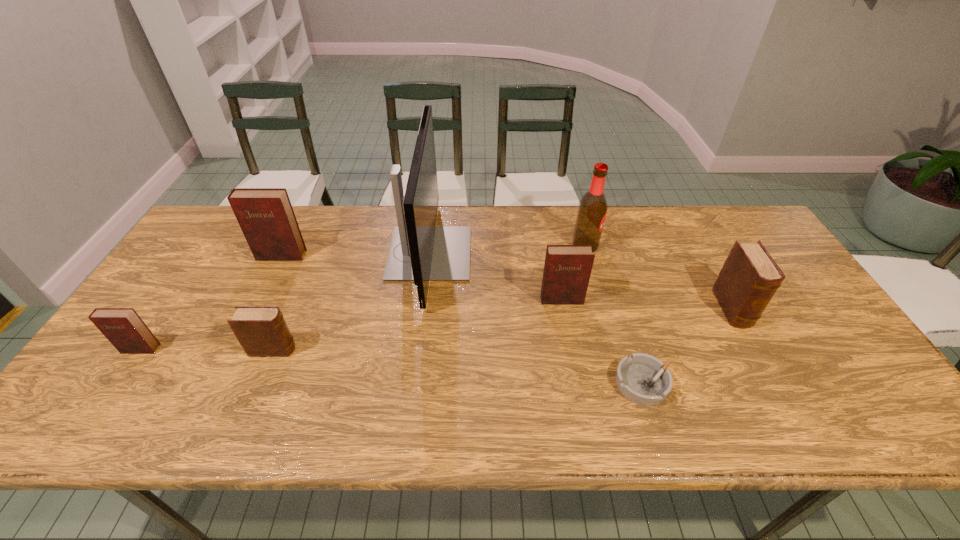
Find the location of a particular element. the fifth object from right to left is located at coordinates (420, 251).

Identify the location of computer monitor. The image size is (960, 540). (420, 251).

In order to click on beer bottle in this screenshot , I will do `click(592, 209)`.

At what (x,y) coordinates should I click in order to perform the action: click on the farthest reddish-brown diary. Please return your answer as a coordinate pair (x, y). The width and height of the screenshot is (960, 540). Looking at the image, I should click on (265, 215).

I want to click on the farthest diary, so click(x=265, y=215).

At what (x,y) coordinates should I click in order to perform the action: click on the bigger brown diary. Please return your answer as a coordinate pair (x, y). This screenshot has width=960, height=540. Looking at the image, I should click on (749, 278).

Image resolution: width=960 pixels, height=540 pixels. I want to click on the right brown diary, so click(749, 278).

Where is `the second nearest reddish-brown diary`? the second nearest reddish-brown diary is located at coordinates (567, 268).

Identify the location of the fifth object from left to right. (567, 268).

Find the location of a particular element. The width and height of the screenshot is (960, 540). the left brown diary is located at coordinates (262, 331).